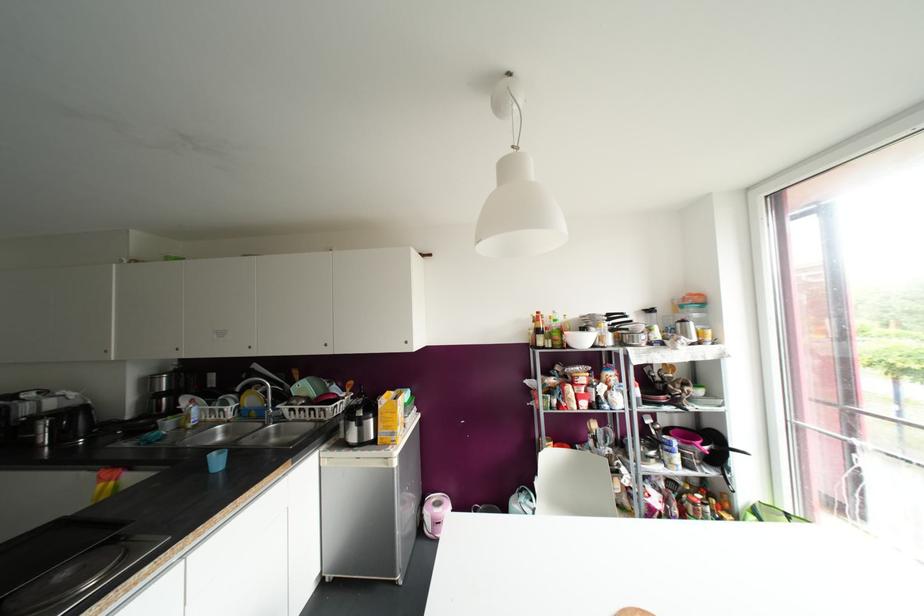
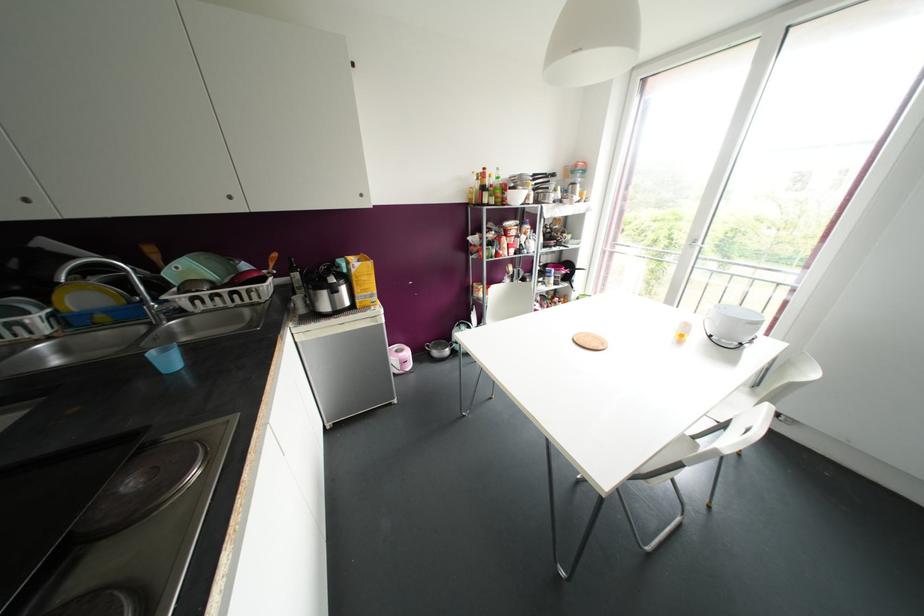
Find the pixel in the second image that matches pixel 251 413 in the first image.

(101, 317)